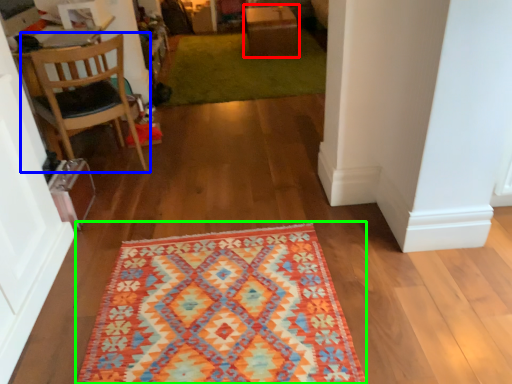
Question: Which is farther away from table (highlighted by a red box)? chair (highlighted by a blue box) or mat (highlighted by a green box)?

Choices:
 (A) chair
 (B) mat

Answer: (B)